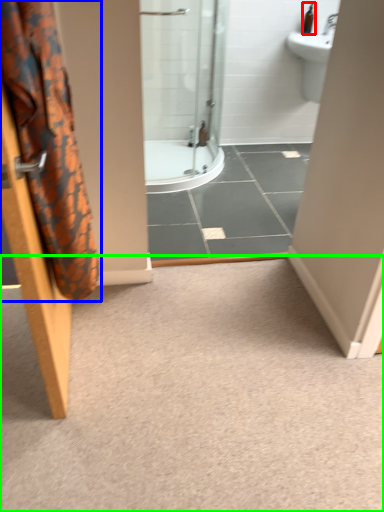
Question: Considering the real-world distances, which object is closest to toiletry (highlighted by a red box)? shower curtain (highlighted by a blue box) or plain (highlighted by a green box).

Choices:
 (A) shower curtain
 (B) plain

Answer: (B)